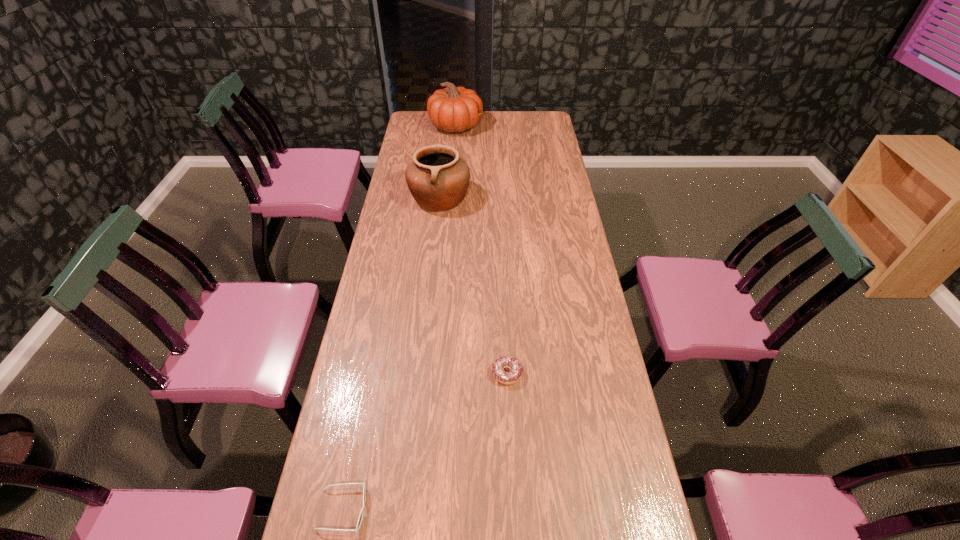
You are a GUI agent. You are given a task and a screenshot of the screen. Output one action in this format:
    pyautogui.click(x=<x>, y=<y>)
    Task: Click on the free point between the rightmost object and the farthest object
    
    Given the screenshot: What is the action you would take?
    pyautogui.click(x=481, y=249)

Where is `free area in between the nearest object and the second farthest object`? Image resolution: width=960 pixels, height=540 pixels. free area in between the nearest object and the second farthest object is located at coordinates (391, 354).

At what (x,y) coordinates should I click in order to perform the action: click on free area in between the nearest object and the farthest object. Please return your answer as a coordinate pair (x, y). This screenshot has height=540, width=960. Looking at the image, I should click on (399, 318).

Locate an element on the screen. vacant region between the farthest object and the nearest object is located at coordinates (399, 318).

This screenshot has width=960, height=540. I want to click on vacant area that lies between the doughnut and the third nearest object, so click(x=473, y=286).

Locate an element on the screen. The width and height of the screenshot is (960, 540). object that is the closest one to the farthest object is located at coordinates (438, 179).

I want to click on object that stands as the closest to the nearest object, so click(511, 377).

The image size is (960, 540). In order to click on blank space that satisfies the following two spatial constraints: 1. on the face of the farthest object; 2. on the left side of the rightmost object in this screenshot , I will do `click(436, 373)`.

Identify the location of free spot that satisfies the following two spatial constraints: 1. on the front side of the second farthest object; 2. with the lenses of the nearest object facing outward. (406, 509).

Identify the location of vacant space that satisfies the following two spatial constraints: 1. on the face of the rightmost object; 2. on the right side of the pumpkin. (436, 373).